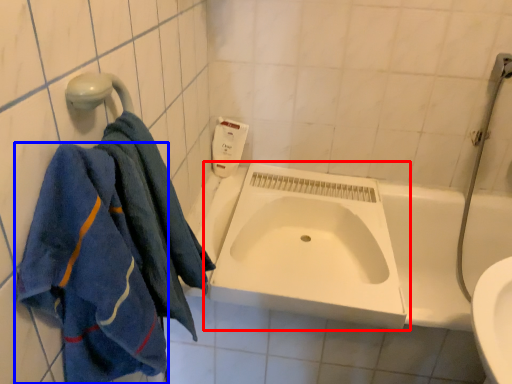
Question: Which of the following is the closest to the observer, sink (highlighted by a red box) or towel (highlighted by a blue box)?

Choices:
 (A) sink
 (B) towel

Answer: (B)